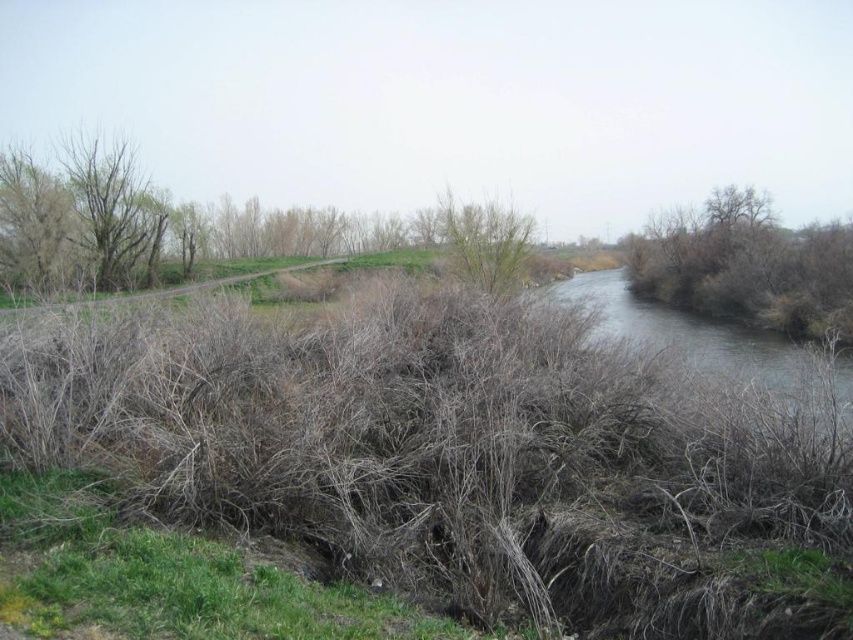
You are a hiker trying to cross the river on the right side. You notice two landmarks nearby to help navigate your path. The first is the brown dry shrub at right and the second is the bare branches at left. Which landmark is larger and could be more easily spotted from a distance?

The brown dry shrub at right is bigger than the bare branches at left, so it would be more easily spotted from a distance.

You are a hiker trying to cross the river on the right side of the image. You see the brown dry shrub at right and the bare branches at left. Which object is closer to the river?

The brown dry shrub at right is closer to the river because it is positioned on the right side of the bare branches at left, and the river is on the right side of the image.

You are standing at the point with coordinates point [706,252] and want to walk to point [126,150]. Which direction should you move relative to your current position?

You should move towards the lower left direction because point [126,150] is closer to the viewer than point [706,252], so it is located in the lower left direction from your current position.